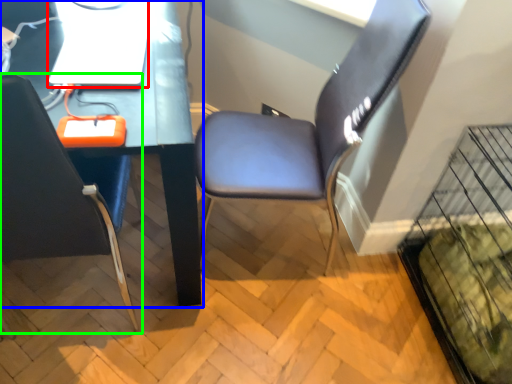
Question: Which object is the farthest from computer (highlighted by a red box)? Choose among these: computer desk (highlighted by a blue box) or chair (highlighted by a green box).

Choices:
 (A) computer desk
 (B) chair

Answer: (B)